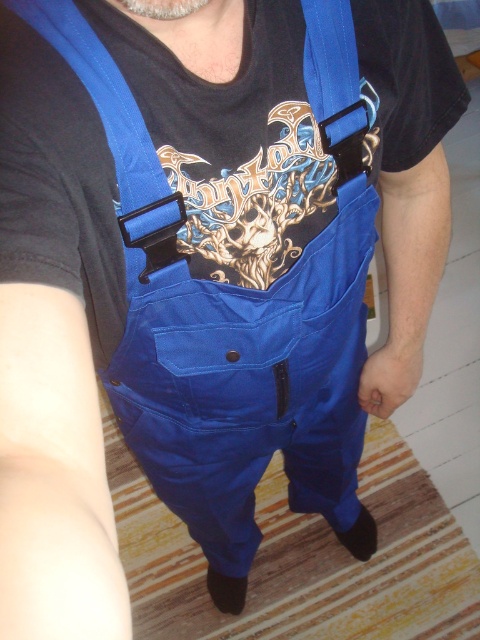
Question: Is blue fabric suspenders at upper center thinner than matte blue straps at upper center?

Choices:
 (A) no
 (B) yes

Answer: (A)

Question: Does blue fabric suspenders at upper center appear over matte blue straps at upper center?

Choices:
 (A) yes
 (B) no

Answer: (B)

Question: Which point is closer to the camera?

Choices:
 (A) (320, 90)
 (B) (211, 170)

Answer: (B)

Question: Is blue fabric suspenders at upper center smaller than matte blue straps at upper center?

Choices:
 (A) yes
 (B) no

Answer: (B)

Question: Which point is farther to the camera?

Choices:
 (A) blue fabric suspenders at upper center
 (B) matte blue straps at upper center

Answer: (B)